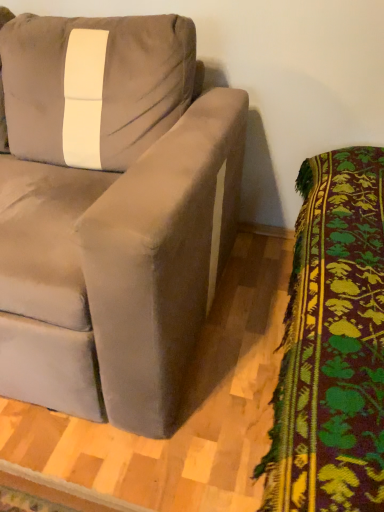
This screenshot has height=512, width=384. I want to click on suede gray couch at center, so [x=111, y=213].

Describe the element at coordinates (111, 213) in the screenshot. I see `suede gray couch at center` at that location.

At what (x,y) coordinates should I click in order to perform the action: click on suede gray couch at center. Please return your answer as a coordinate pair (x, y). The image size is (384, 512). Looking at the image, I should click on (111, 213).